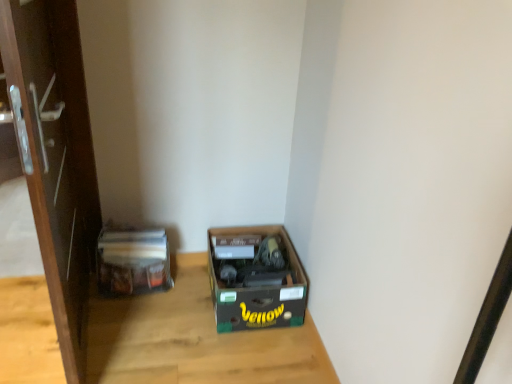
At what (x,y) coordinates should I click in order to perform the action: click on vacant area that lies between brown cardboard box at lower center and matte plastic bag at left. Please return your answer as a coordinate pair (x, y). This screenshot has width=512, height=384. Looking at the image, I should click on (178, 303).